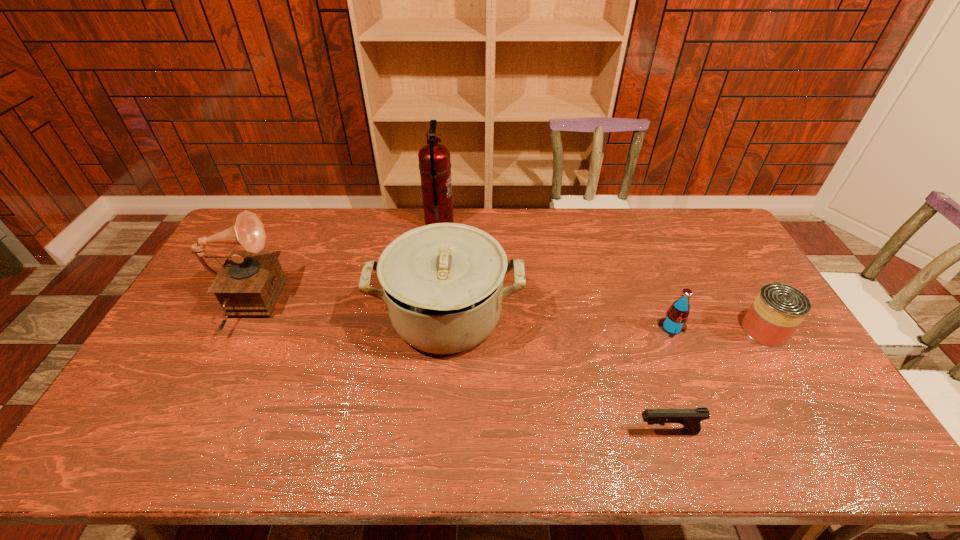
The height and width of the screenshot is (540, 960). What are the coordinates of `vacant region that satisfies the following two spatial constraints: 1. on the nozzle side of the farthest object; 2. on the right side of the soda` in the screenshot? It's located at (428, 328).